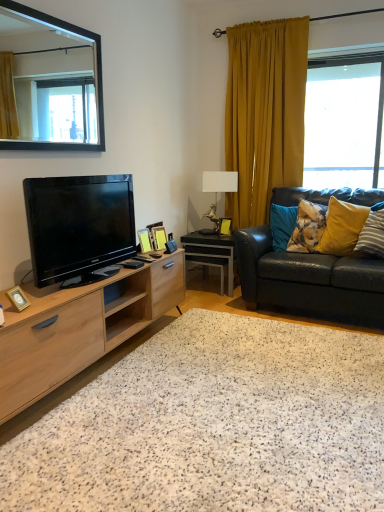
Find the location of a particular element. The image size is (384, 512). vacant space to the right of gold metallic photo frame at lower left, the 4th picture frame when ordered from right to left is located at coordinates (46, 305).